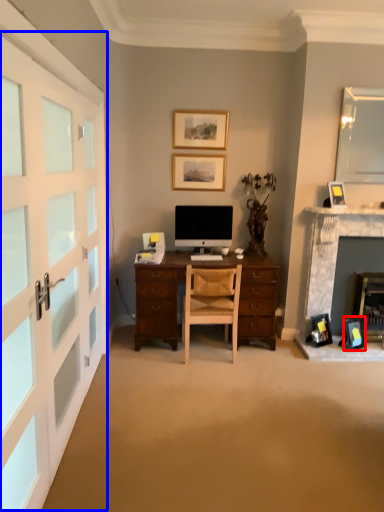
Question: Which point is further to the camera, picture frame (highlighted by a red box) or garage door (highlighted by a blue box)?

Choices:
 (A) picture frame
 (B) garage door

Answer: (A)